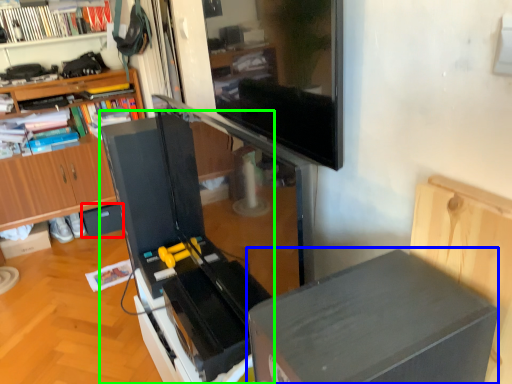
Question: Which object is positioned closest to drawer (highlighted by a red box)? Select from table (highlighted by a blue box) and appliance (highlighted by a green box).

Choices:
 (A) table
 (B) appliance

Answer: (B)